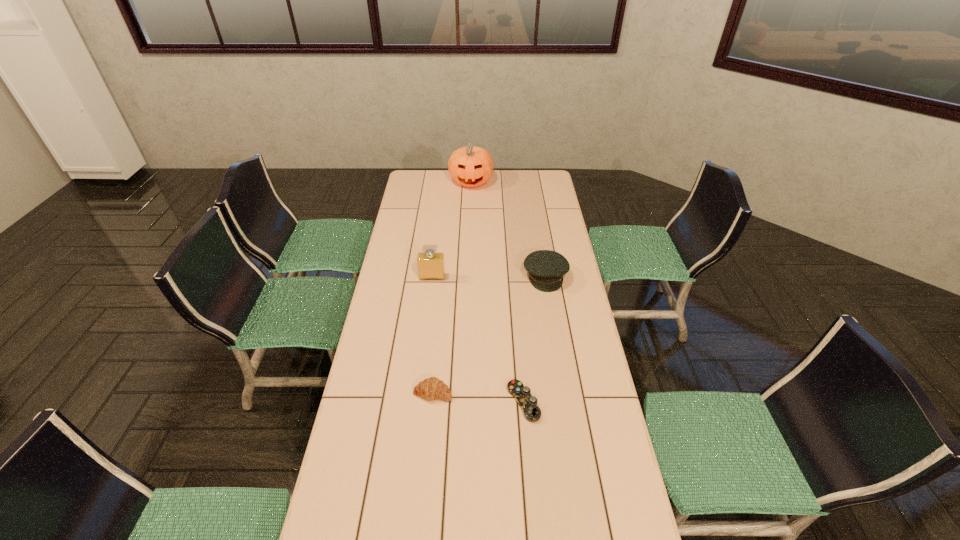
Find the location of a particular element. This screenshot has height=540, width=960. the closest object to the pumpkin is located at coordinates (546, 268).

The height and width of the screenshot is (540, 960). I want to click on free spot that satisfies the following two spatial constraints: 1. on the front-facing side of the control; 2. on the left side of the perfume, so click(x=418, y=402).

Find the location of `blank area in the image that satisfies the following two spatial constraints: 1. on the front-facing side of the control; 2. on the left side of the perfume`. blank area in the image that satisfies the following two spatial constraints: 1. on the front-facing side of the control; 2. on the left side of the perfume is located at coordinates (418, 402).

Where is `vacant space that satisfies the following two spatial constraints: 1. on the front side of the second shortest object; 2. on the left side of the shortest object`? This screenshot has width=960, height=540. vacant space that satisfies the following two spatial constraints: 1. on the front side of the second shortest object; 2. on the left side of the shortest object is located at coordinates (432, 402).

Image resolution: width=960 pixels, height=540 pixels. I want to click on vacant area that satisfies the following two spatial constraints: 1. on the front-facing side of the farthest object; 2. on the right side of the control, so click(465, 402).

Image resolution: width=960 pixels, height=540 pixels. Identify the location of vacant region that satisfies the following two spatial constraints: 1. on the front-facing side of the perfume; 2. on the left side of the shortest object. (418, 402).